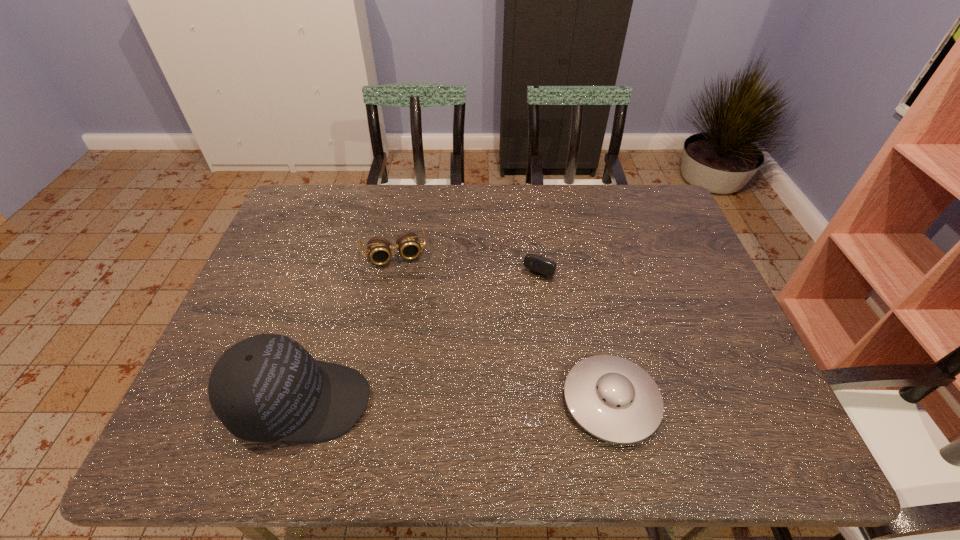
Find the location of a particular element. vacant space positioned on the front-facing side of the webcam is located at coordinates (509, 330).

Where is `vacant space located 0.310m on the front-facing side of the webcam`? vacant space located 0.310m on the front-facing side of the webcam is located at coordinates (489, 363).

Find the location of a particular element. This screenshot has height=540, width=960. object that is positioned at the far edge is located at coordinates (539, 264).

Find the location of a particular element. This screenshot has width=960, height=540. baseball cap present at the near edge is located at coordinates (266, 388).

Identify the location of saucer at the near edge. (615, 400).

The height and width of the screenshot is (540, 960). Identify the location of object that is positioned at the left edge. (266, 388).

Where is `object that is at the near left corner`? Image resolution: width=960 pixels, height=540 pixels. object that is at the near left corner is located at coordinates (266, 388).

Find the location of a particular element. The width and height of the screenshot is (960, 540). vacant space at the far edge is located at coordinates 409,227.

Identify the location of blank space at the near edge of the desktop. The height and width of the screenshot is (540, 960). (439, 409).

Locate an element on the screen. This screenshot has width=960, height=540. free space at the right edge of the desktop is located at coordinates [663, 308].